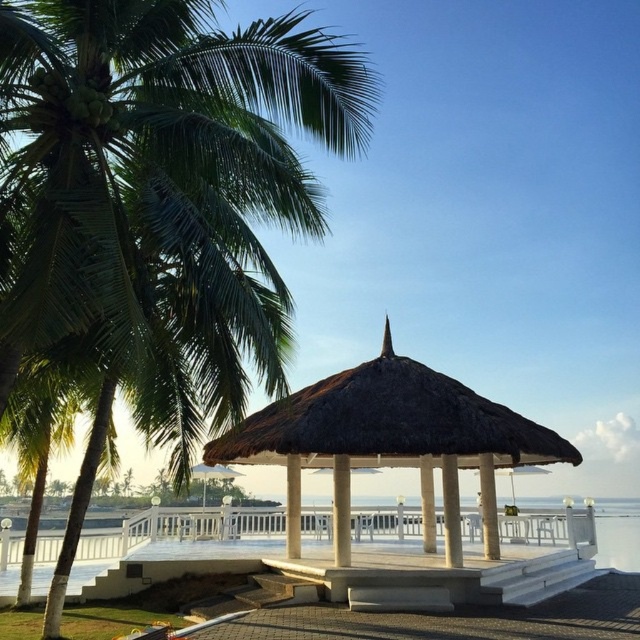
Does green leafy palm tree at left have a larger size compared to thatched wood gazebo at center?

Yes, green leafy palm tree at left is bigger than thatched wood gazebo at center.

Does green leafy palm tree at left appear over thatched wood gazebo at center?

Yes, green leafy palm tree at left is above thatched wood gazebo at center.

Locate an element on the screen. Image resolution: width=640 pixels, height=640 pixels. green leafy palm tree at left is located at coordinates (160, 204).